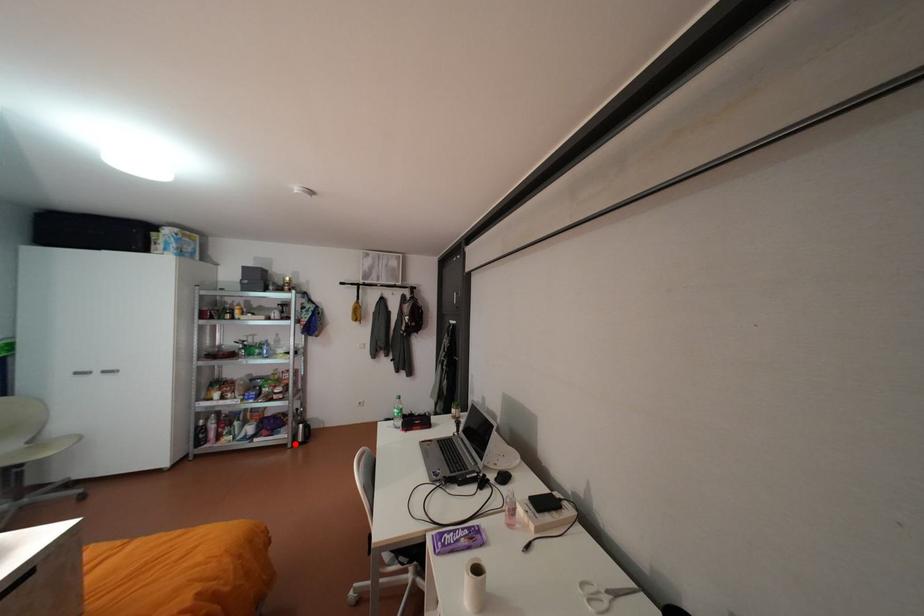
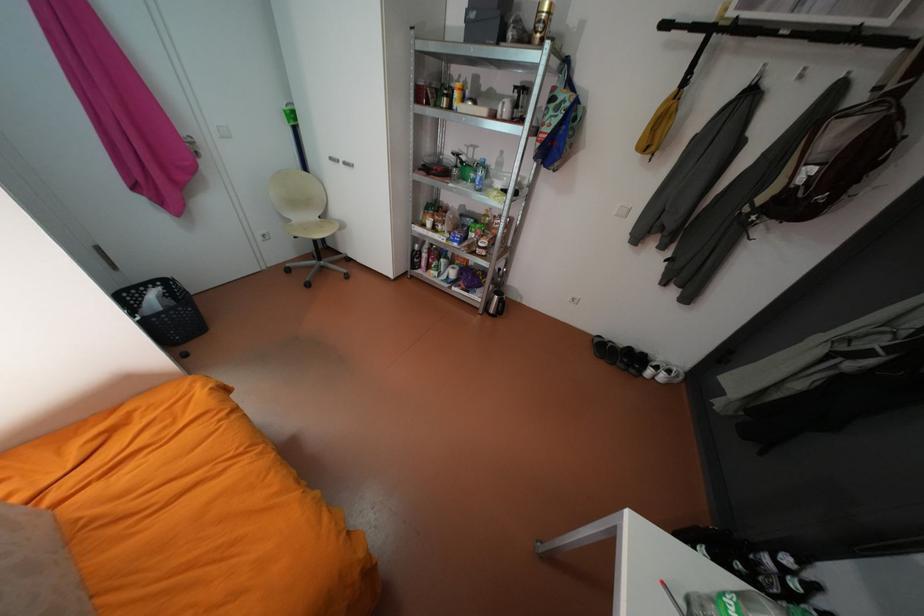
The point at the highlighted location is marked in the first image. Where is the corresponding point in the second image?

(487, 308)